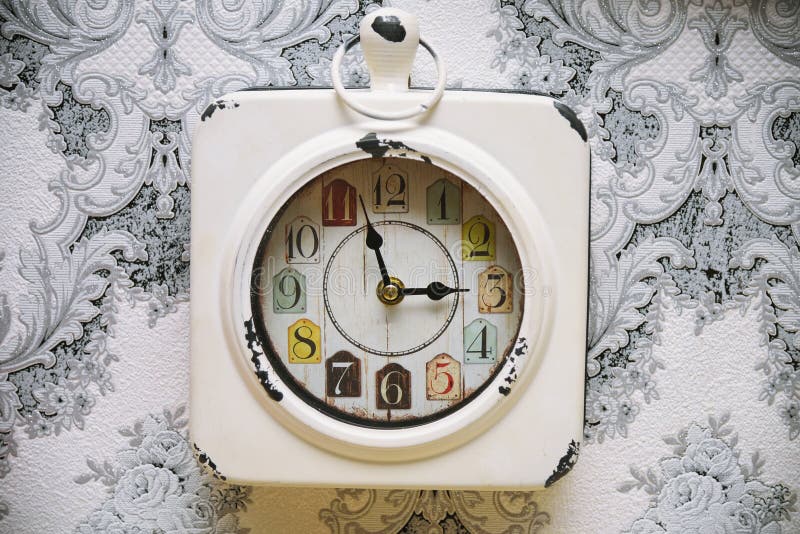
Locate an element on the screen. This screenshot has width=800, height=534. white metal clock is located at coordinates click(x=525, y=139).